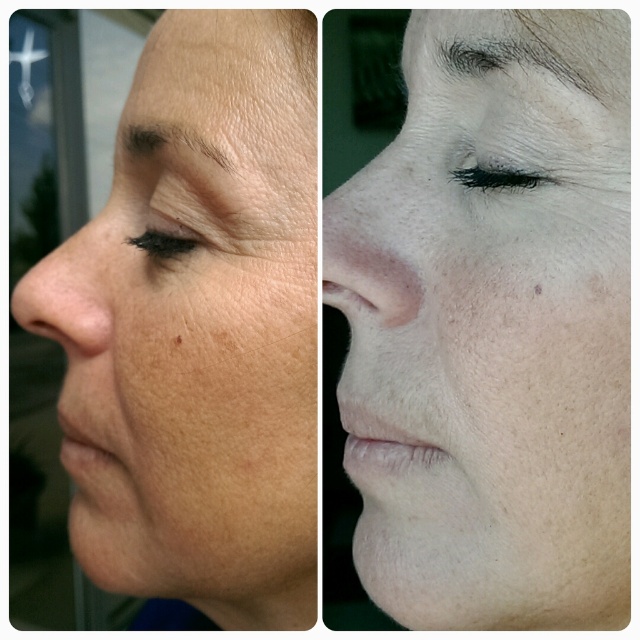
You are a photographer analyzing the two points on the face in the image. Which point is closer to the camera, point [342,253] or point [442,54]?

Point [342,253] is in front of point [442,54], so it is closer to the camera.

Consider the image. You are a skincare consultant analyzing the image of a person with dry skin at upper left and black matte eyelashes at upper center. Which feature is closer to the viewer? Please explain based on their positions in the image.

The dry skin at upper left is closer to the viewer than the black matte eyelashes at upper center because it is positioned further forward in the image.